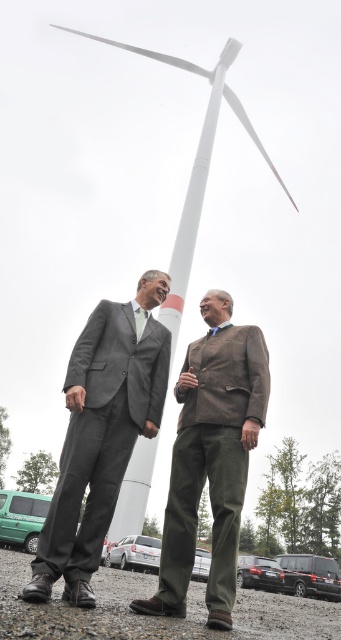
Does gray suit at center appear over brown textured blazer at center?

Yes.

Between point (68, 500) and point (209, 400), which one is positioned in front?

Point (68, 500) is in front.

What do you see at coordinates (101, 433) in the screenshot?
I see `gray suit at center` at bounding box center [101, 433].

The height and width of the screenshot is (640, 341). In order to click on gray suit at center in this screenshot , I will do tap(101, 433).